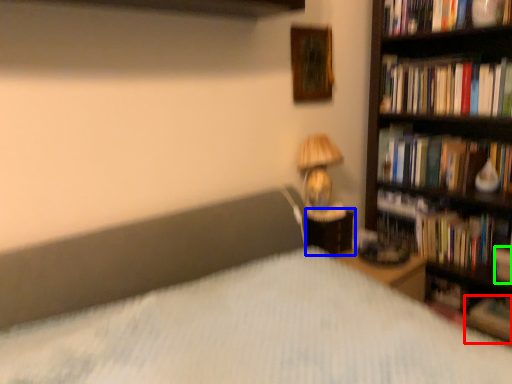
Question: Based on their relative distances, which object is nearer to book (highlighted by a red box)? Choose from nightstand (highlighted by a blue box) and paperback book (highlighted by a green box).

Choices:
 (A) nightstand
 (B) paperback book

Answer: (B)